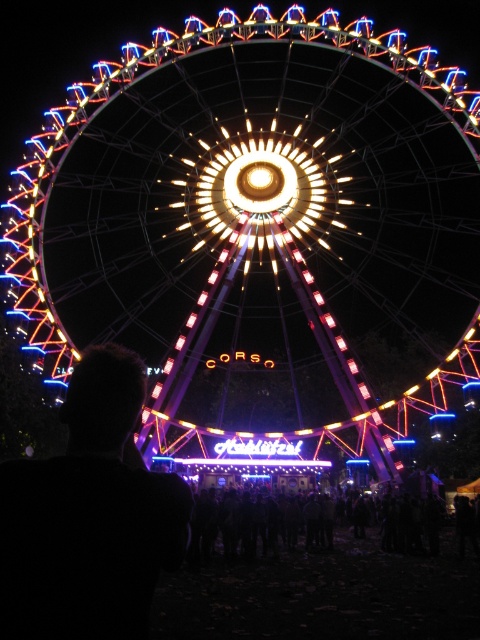
Question: Which point is farther to the camera?

Choices:
 (A) (365, 193)
 (B) (468, 513)
 (C) (157, 554)

Answer: (A)

Question: Is illuminated steel ferris wheel at center bigger than black fabric crowd at lower center?

Choices:
 (A) no
 (B) yes

Answer: (B)

Question: Which of the following is the closest to the observer?

Choices:
 (A) (230, 538)
 (B) (105, 592)
 (C) (346, 196)

Answer: (B)

Question: Can you confirm if black hair at left is wider than black fabric crowd at lower center?

Choices:
 (A) yes
 (B) no

Answer: (B)

Question: Where is black hair at left located in relation to black fabric crowd at lower center in the image?

Choices:
 (A) below
 (B) above

Answer: (B)

Question: Estimate the real-world distances between objects in this image. Which object is closer to the illuminated steel ferris wheel at center?

Choices:
 (A) black fabric crowd at lower center
 (B) black hair at left

Answer: (A)